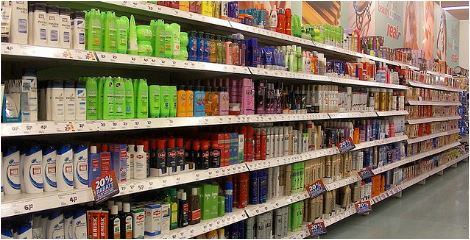
I want to click on bottom shelf, so click(x=300, y=232), click(x=336, y=219), click(x=412, y=181), click(x=453, y=161).